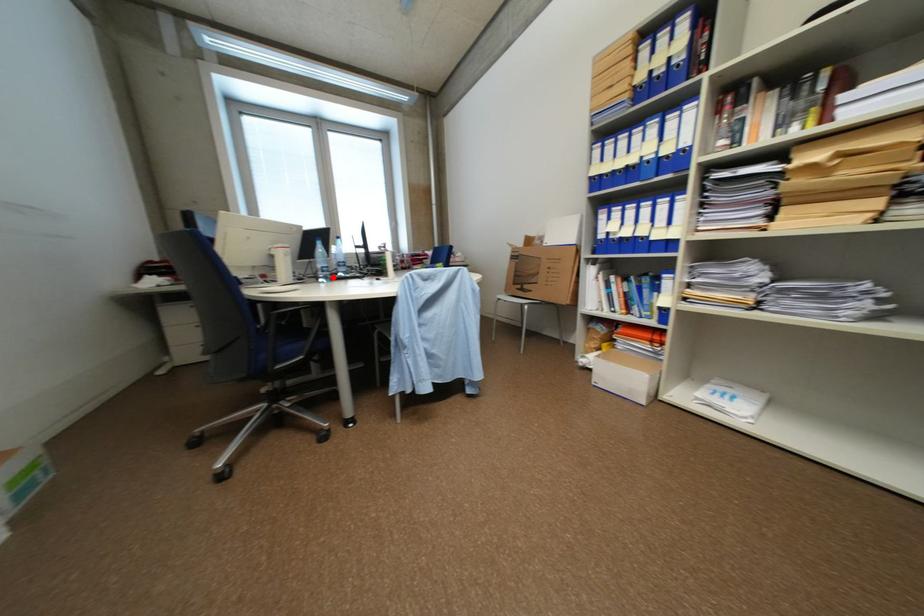
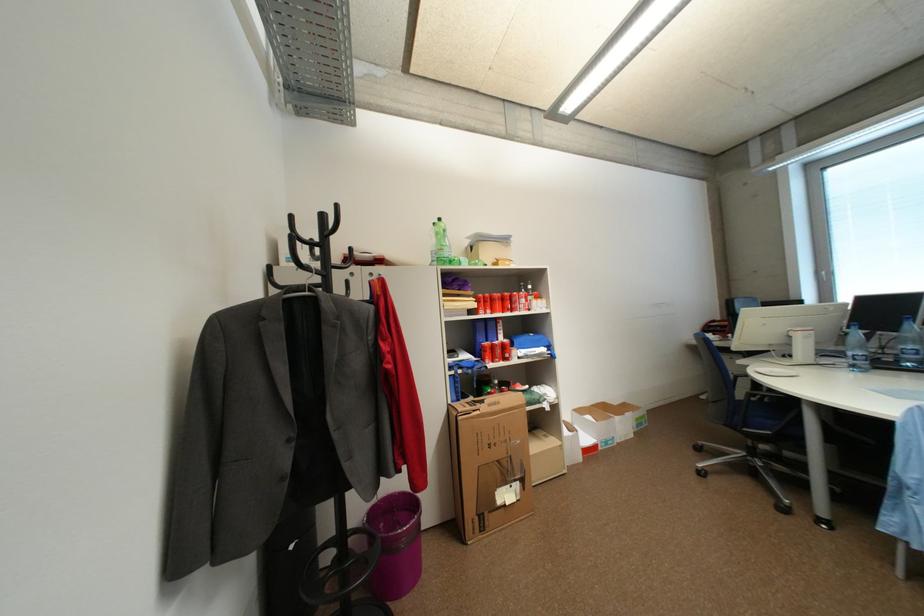
In the second image, find the point that corresponds to the highlighted location in the first image.

(861, 367)